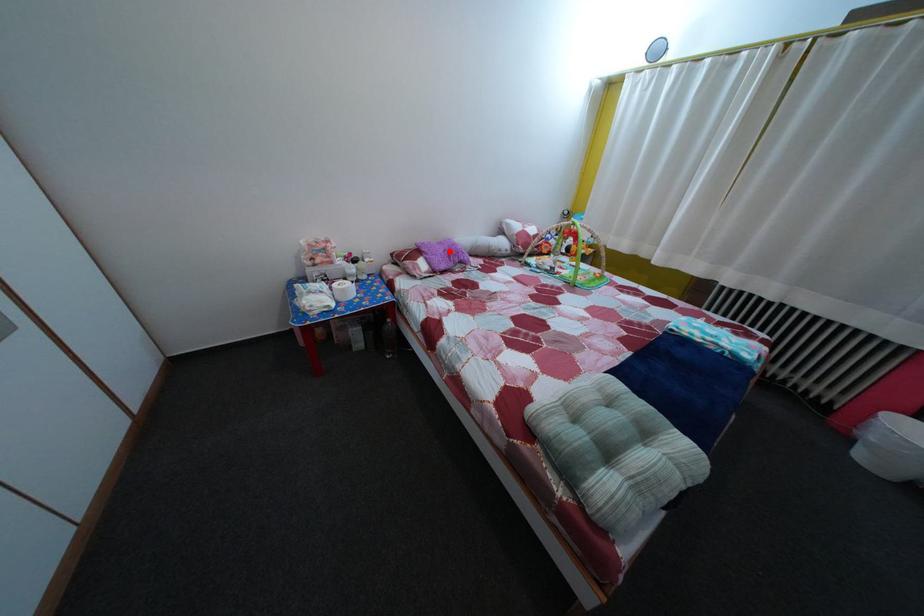
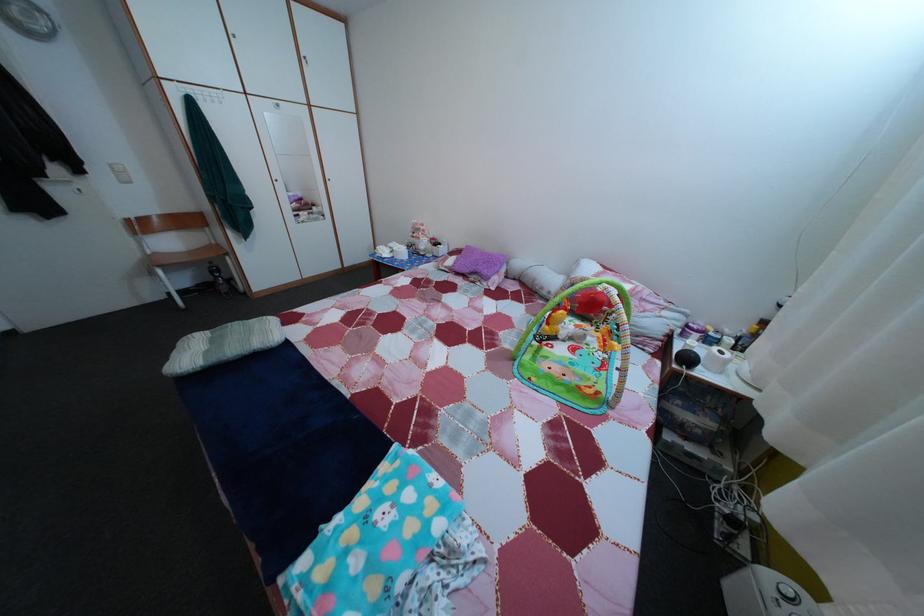
Find the pixel in the second image that matches the highlighted location in the first image.

(492, 261)